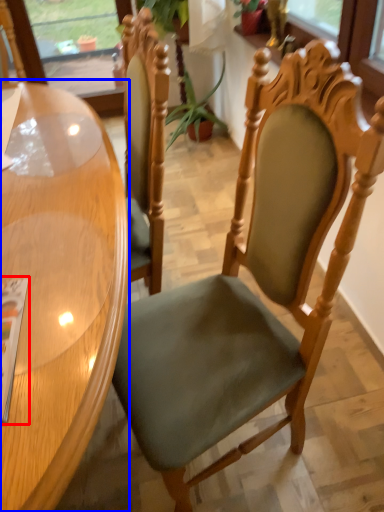
Question: Among these objects, which one is farthest to the camera, magazine (highlighted by a red box) or table (highlighted by a blue box)?

Choices:
 (A) magazine
 (B) table

Answer: (A)